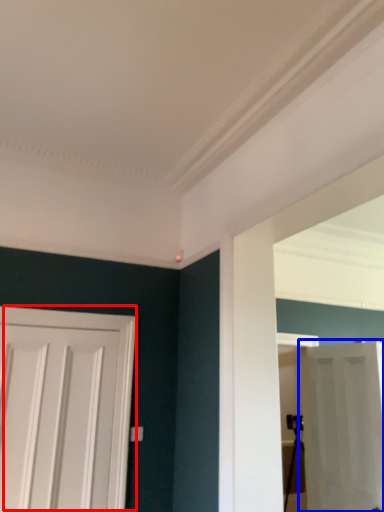
Question: Which of the following is the closest to the observer, door (highlighted by a red box) or door (highlighted by a blue box)?

Choices:
 (A) door
 (B) door

Answer: (A)